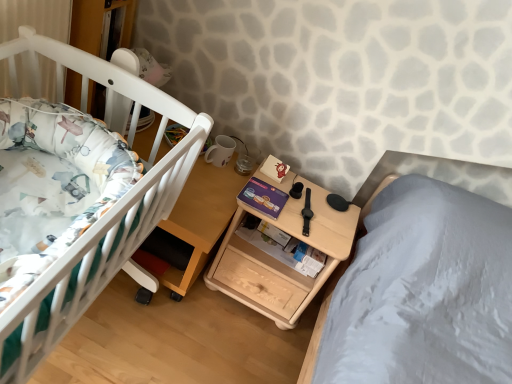
Question: Should I look upward or downward to see wooden bookshelf at upper left?

Choices:
 (A) up
 (B) down

Answer: (A)

Question: Does white matte crib at left have a smaller size compared to wooden bookshelf at upper left?

Choices:
 (A) no
 (B) yes

Answer: (A)

Question: Can you confirm if white matte crib at left is shorter than wooden bookshelf at upper left?

Choices:
 (A) yes
 (B) no

Answer: (B)

Question: Considering the relative sizes of white matte crib at left and wooden bookshelf at upper left in the image provided, is white matte crib at left wider than wooden bookshelf at upper left?

Choices:
 (A) yes
 (B) no

Answer: (A)

Question: Can wooden bookshelf at upper left be found inside white matte crib at left?

Choices:
 (A) yes
 (B) no

Answer: (B)

Question: Considering the relative sizes of white matte crib at left and wooden bookshelf at upper left in the image provided, is white matte crib at left bigger than wooden bookshelf at upper left?

Choices:
 (A) yes
 (B) no

Answer: (A)

Question: Can you confirm if white matte crib at left is positioned to the right of wooden bookshelf at upper left?

Choices:
 (A) no
 (B) yes

Answer: (B)

Question: Is wooden table at left thinner than natural wood nightstand at center?

Choices:
 (A) yes
 (B) no

Answer: (B)

Question: Can you confirm if wooden table at left is positioned to the left of natural wood nightstand at center?

Choices:
 (A) yes
 (B) no

Answer: (A)

Question: Is natural wood nightstand at center a part of wooden table at left?

Choices:
 (A) no
 (B) yes

Answer: (A)

Question: Is wooden table at left next to natural wood nightstand at center and touching it?

Choices:
 (A) yes
 (B) no

Answer: (B)

Question: From the image's perspective, is wooden table at left on natural wood nightstand at center?

Choices:
 (A) no
 (B) yes

Answer: (B)

Question: Can you confirm if wooden table at left is bigger than natural wood nightstand at center?

Choices:
 (A) yes
 (B) no

Answer: (A)

Question: Is natural wood nightstand at center at the back of wooden bookshelf at upper left?

Choices:
 (A) yes
 (B) no

Answer: (B)